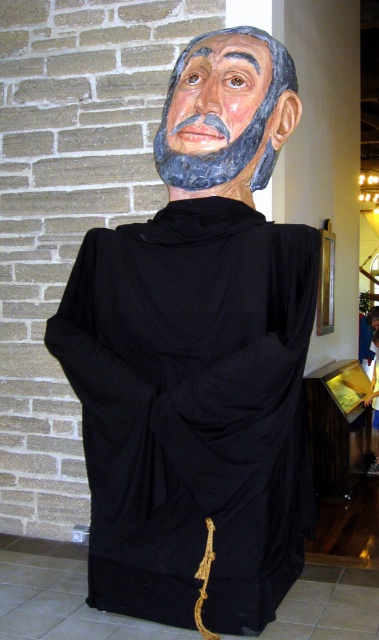
Question: Does matte black statue at center appear under matte black mask at upper center?

Choices:
 (A) no
 (B) yes

Answer: (B)

Question: Which point appears closest to the camera in this image?

Choices:
 (A) (217, 90)
 (B) (156, 605)

Answer: (B)

Question: Can you confirm if matte black statue at center is wider than matte black mask at upper center?

Choices:
 (A) no
 (B) yes

Answer: (B)

Question: From the image, what is the correct spatial relationship of matte black statue at center in relation to matte black mask at upper center?

Choices:
 (A) left
 (B) right

Answer: (A)

Question: Which object is farther from the camera taking this photo?

Choices:
 (A) matte black statue at center
 (B) matte black mask at upper center

Answer: (B)

Question: Which point appears farthest from the camera in this image?

Choices:
 (A) (264, 312)
 (B) (200, 93)

Answer: (B)